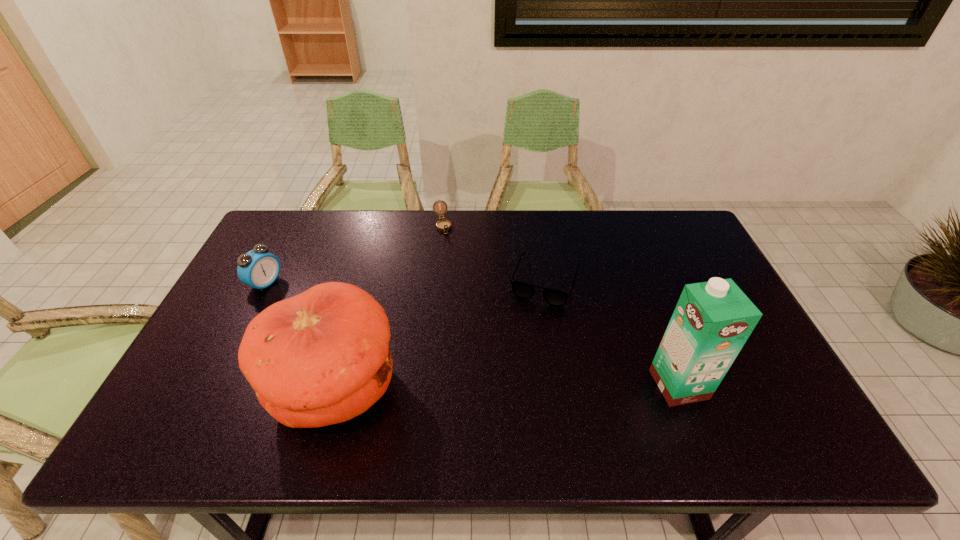
Find the location of a particular element. The height and width of the screenshot is (540, 960). carton that is positioned at the near edge is located at coordinates (712, 320).

Identify the location of object present at the left edge. (258, 268).

In the image, there is a desktop. In order to click on blank space at the far edge in this screenshot , I will do `click(578, 237)`.

Identify the location of free spot at the near edge of the desktop. This screenshot has width=960, height=540. (512, 390).

In the image, there is a desktop. Identify the location of vacant space at the right edge. The image size is (960, 540). (713, 275).

Image resolution: width=960 pixels, height=540 pixels. In order to click on free space at the far left corner in this screenshot , I will do `click(274, 232)`.

Image resolution: width=960 pixels, height=540 pixels. Find the location of `free space at the far right corner of the desktop`. free space at the far right corner of the desktop is located at coordinates (669, 252).

The width and height of the screenshot is (960, 540). I want to click on vacant space that's between the spectacles and the carton, so click(x=612, y=332).

Identify the location of vacant space that's between the alarm clock and the second object from right to left. (405, 281).

Find the location of `free space that is in between the fourth object from left to right and the carton`. free space that is in between the fourth object from left to right and the carton is located at coordinates (612, 332).